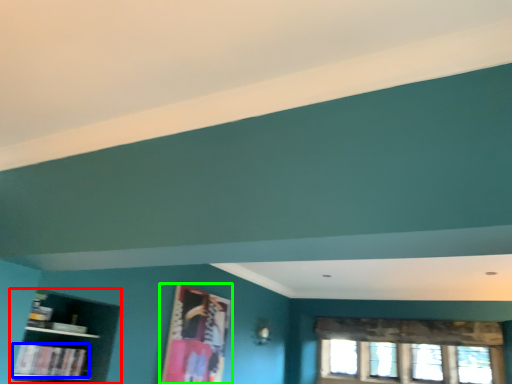
Question: Which object is positioned closest to shelf (highlighted by a red box)? Select from book (highlighted by a blue box) and picture frame (highlighted by a green box).

Choices:
 (A) book
 (B) picture frame

Answer: (A)